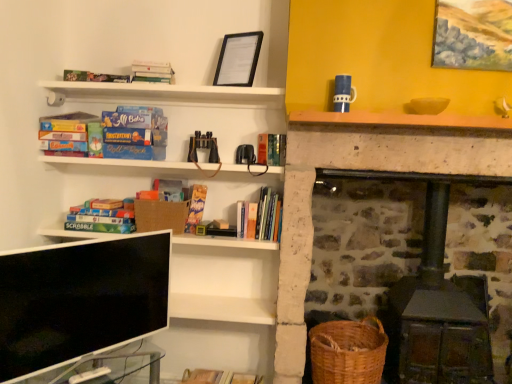
What is the approximate height of oil painting at upper right, acting as the second picture frame starting from the left?

It is 13.50 inches.

The height and width of the screenshot is (384, 512). What do you see at coordinates (79, 300) in the screenshot?
I see `matte white tv at lower left` at bounding box center [79, 300].

You are a GUI agent. You are given a task and a screenshot of the screen. Output one action in this format:
    pyautogui.click(x=<x>, y=<y>)
    Task: Click on the matte cardboard board game at left, marked as the fifth book in a right-to-left arrangement
    The image size is (512, 384).
    Given the screenshot: What is the action you would take?
    pyautogui.click(x=65, y=134)

What do you see at coordinates (65, 134) in the screenshot? The width and height of the screenshot is (512, 384). I see `matte cardboard board game at left, the 3th book positioned from the top` at bounding box center [65, 134].

Measure the distance between point (159, 356) and camera.

The distance of point (159, 356) from camera is 8.55 feet.

Locate an element on the screen. The height and width of the screenshot is (384, 512). burlap basket at lower left, the second basket viewed from the right is located at coordinates pos(160,215).

You are a GUI agent. You are given a task and a screenshot of the screen. Output one action in this format:
    pyautogui.click(x=<x>, y=<y>)
    Task: Click on the green matte scrabble board game at lower left, which is the first paperback book in left-to-right order
    The height and width of the screenshot is (384, 512).
    Given the screenshot: What is the action you would take?
    pyautogui.click(x=100, y=227)

At what (x,y) coordinates should I click in order to perform the action: click on oil painting at upper right, the second picture frame when ordered from back to front. Please return your answer as a coordinate pair (x, y). This screenshot has height=384, width=512. Looking at the image, I should click on (473, 34).

How different are the orientations of black matte picture frame at upper center, which is the second picture frame from front to back, and hardcover book at center, which is the 1th book in right-to-left order, in degrees?

There is a 26.2-degree angle between the facing directions of black matte picture frame at upper center, which is the second picture frame from front to back, and hardcover book at center, which is the 1th book in right-to-left order.

From a real-world perspective, does black matte picture frame at upper center, which is the 1th picture frame in left-to-right order, stand above hardcover book at center, the 5th book viewed from the left?

Correct, in the physical world, black matte picture frame at upper center, which is the 1th picture frame in left-to-right order, is higher than hardcover book at center, the 5th book viewed from the left.

Who is bigger, black matte picture frame at upper center, which ranks as the first picture frame in back-to-front order, or hardcover book at center, the 5th book viewed from the left?

black matte picture frame at upper center, which ranks as the first picture frame in back-to-front order.

From their relative heights in the image, would you say black matte picture frame at upper center, which is the second picture frame from front to back, is taller or shorter than hardcover book at center, the 5th book viewed from the left?

In the image, black matte picture frame at upper center, which is the second picture frame from front to back, appears to be taller than hardcover book at center, the 5th book viewed from the left.

How different are the orientations of oil painting at upper right, which is the 1th picture frame in right-to-left order, and black matte picture frame at upper center, which is the second picture frame from right to left, in degrees?

There is a 26.5-degree angle between the facing directions of oil painting at upper right, which is the 1th picture frame in right-to-left order, and black matte picture frame at upper center, which is the second picture frame from right to left.

From the image's perspective, which is above, oil painting at upper right, which is the 1th picture frame in right-to-left order, or black matte picture frame at upper center, which is the second picture frame from front to back?

From the image's view, oil painting at upper right, which is the 1th picture frame in right-to-left order, is above.

Is black matte picture frame at upper center, which is the 1th picture frame in left-to-right order, completely or partially inside oil painting at upper right, placed as the 1th picture frame when sorted from front to back?

No, black matte picture frame at upper center, which is the 1th picture frame in left-to-right order, is located outside of oil painting at upper right, placed as the 1th picture frame when sorted from front to back.

Considering the relative sizes of oil painting at upper right, acting as the second picture frame starting from the left, and black matte picture frame at upper center, which is the second picture frame from front to back, in the image provided, is oil painting at upper right, acting as the second picture frame starting from the left, shorter than black matte picture frame at upper center, which is the second picture frame from front to back,?

Incorrect, the height of oil painting at upper right, acting as the second picture frame starting from the left, does not fall short of that of black matte picture frame at upper center, which is the second picture frame from front to back.

Considering the sizes of black matte picture frame at upper center, which is the second picture frame from front to back, and hardcover book at upper center, the 5th book when ordered from bottom to top, in the image, is black matte picture frame at upper center, which is the second picture frame from front to back, taller or shorter than hardcover book at upper center, the 5th book when ordered from bottom to top,?

In the image, black matte picture frame at upper center, which is the second picture frame from front to back, appears to be taller than hardcover book at upper center, the 5th book when ordered from bottom to top.

This screenshot has width=512, height=384. There is a hardcover book at upper center, placed as the first book when sorted from top to bottom. Identify the location of the 1st picture frame above it (from the image's perspective). (238, 59).

Could you tell me if black matte picture frame at upper center, which is the second picture frame from right to left, is turned towards hardcover book at upper center, placed as the first book when sorted from top to bottom?

No, black matte picture frame at upper center, which is the second picture frame from right to left, is not turned towards hardcover book at upper center, placed as the first book when sorted from top to bottom.

The width and height of the screenshot is (512, 384). In order to click on the 5th book above the woven brown basket at lower right, the first basket from the right (from the image's perspective) in this screenshot , I will do `click(152, 72)`.

In terms of size, does woven brown basket at lower right, the second basket positioned from the left, appear bigger or smaller than hardcover book at upper center, acting as the 2th book starting from the right?

Clearly, woven brown basket at lower right, the second basket positioned from the left, is larger in size than hardcover book at upper center, acting as the 2th book starting from the right.

Are woven brown basket at lower right, the second basket positioned from the left, and hardcover book at upper center, placed as the first book when sorted from top to bottom, beside each other?

woven brown basket at lower right, the second basket positioned from the left, and hardcover book at upper center, placed as the first book when sorted from top to bottom, are clearly separated.

Considering the relative sizes of woven brown basket at lower right, the 2th basket positioned from the top, and hardcover book at upper center, placed as the first book when sorted from top to bottom, in the image provided, is woven brown basket at lower right, the 2th basket positioned from the top, taller than hardcover book at upper center, placed as the first book when sorted from top to bottom,?

Yes, woven brown basket at lower right, the 2th basket positioned from the top, is taller than hardcover book at upper center, placed as the first book when sorted from top to bottom.

Considering the relative sizes of matte cardboard board game at left, arranged as the first book when viewed from the left, and hardcover book at upper left, placed as the 3th book when sorted from left to right, in the image provided, is matte cardboard board game at left, arranged as the first book when viewed from the left, thinner than hardcover book at upper left, placed as the 3th book when sorted from left to right,?

Incorrect, the width of matte cardboard board game at left, arranged as the first book when viewed from the left, is not less than that of hardcover book at upper left, placed as the 3th book when sorted from left to right.

From a real-world perspective, relative to hardcover book at upper left, acting as the third book starting from the right, is matte cardboard board game at left, marked as the fifth book in a right-to-left arrangement, vertically above or below?

In terms of real-world spatial position, matte cardboard board game at left, marked as the fifth book in a right-to-left arrangement, is below hardcover book at upper left, acting as the third book starting from the right.

Which book is the 2nd one when counting from the right side of the matte cardboard board game at left, marked as the fifth book in a right-to-left arrangement? Please provide its 2D coordinates.

[(94, 77)]

Consider the image. Is matte cardboard board game at left, marked as the fifth book in a right-to-left arrangement, shorter than hardcover book at upper left, which is the 4th book in bottom-to-top order?

In fact, matte cardboard board game at left, marked as the fifth book in a right-to-left arrangement, may be taller than hardcover book at upper left, which is the 4th book in bottom-to-top order.

In the image, is hardcover book at center, which ranks as the 2th paperback book in bottom-to-top order, positioned in front of or behind woven brown basket at lower right, the second basket positioned from the left?

Clearly, hardcover book at center, which ranks as the 2th paperback book in bottom-to-top order, is behind woven brown basket at lower right, the second basket positioned from the left.

Does point (193, 195) appear closer or farther from the camera than point (354, 346)?

Point (193, 195) appears to be farther away from the viewer than point (354, 346).

Considering the sizes of hardcover book at center, arranged as the 3th paperback book when viewed from the left, and woven brown basket at lower right, the second basket positioned from the left, in the image, is hardcover book at center, arranged as the 3th paperback book when viewed from the left, wider or thinner than woven brown basket at lower right, the second basket positioned from the left,?

In the image, hardcover book at center, arranged as the 3th paperback book when viewed from the left, appears to be more narrow than woven brown basket at lower right, the second basket positioned from the left.

Between matte white tv at lower left and hardcover book at center, which is the 1th book in right-to-left order, which one has larger width?

With larger width is matte white tv at lower left.

Which is more to the left, matte white tv at lower left or hardcover book at center, the second book in the bottom-to-top sequence?

matte white tv at lower left.

Considering the relative positions of matte white tv at lower left and hardcover book at center, the second book in the bottom-to-top sequence, in the image provided, is matte white tv at lower left behind hardcover book at center, the second book in the bottom-to-top sequence,?

No, matte white tv at lower left is closer to the camera.

Which of these two, matte white tv at lower left or hardcover book at center, the second book in the bottom-to-top sequence, is bigger?

matte white tv at lower left is bigger.

The width and height of the screenshot is (512, 384). I want to click on book on the right of the black matte picture frame at upper center, which is the second picture frame from front to back, so click(x=271, y=149).

In order to click on picture frame that appears above the black matte picture frame at upper center, which ranks as the first picture frame in back-to-front order (from the image's perspective) in this screenshot , I will do `click(473, 34)`.

When comparing their distances from matte green paperback book at left, the first paperback book when ordered from top to bottom, does hardcover book at upper left, the second book viewed from the top, or hardcover book at center, acting as the first paperback book starting from the right, seem further?

hardcover book at center, acting as the first paperback book starting from the right.

When comparing their distances from matte green board game at left, the 5th book when ordered from top to bottom, does green matte scrabble board game at lower left, which is the first paperback book in left-to-right order, or matte white tv at lower left seem further?

The object further to matte green board game at left, the 5th book when ordered from top to bottom, is matte white tv at lower left.

Looking at the image, which one is located closer to transparent glass table at lower left, matte cardboard board game at left, marked as the fifth book in a right-to-left arrangement, or hardcover book at upper center, acting as the 2th book starting from the right?

matte cardboard board game at left, marked as the fifth book in a right-to-left arrangement, is closer to transparent glass table at lower left.

Estimate the real-world distances between objects in this image. Which object is closer to hardcover book at center, arranged as the 3th paperback book when viewed from the left, matte green paperback book at left, which ranks as the third paperback book in bottom-to-top order, or matte cardboard board game at left, the third book in the bottom-to-top sequence?

The object closer to hardcover book at center, arranged as the 3th paperback book when viewed from the left, is matte green paperback book at left, which ranks as the third paperback book in bottom-to-top order.

When comparing their distances from matte cardboard board game at left, arranged as the first book when viewed from the left, does hardcover book at center, the 5th book viewed from the left, or matte green board game at left, positioned as the 1th book in bottom-to-top order, seem closer?

matte green board game at left, positioned as the 1th book in bottom-to-top order, is closer to matte cardboard board game at left, arranged as the first book when viewed from the left.

When comparing their distances from oil painting at upper right, which is the 1th picture frame in right-to-left order, does matte green board game at left, the 5th book when ordered from top to bottom, or hardcover book at upper center, the 5th book when ordered from bottom to top, seem closer?

hardcover book at upper center, the 5th book when ordered from bottom to top, is closer to oil painting at upper right, which is the 1th picture frame in right-to-left order.

When comparing their distances from hardcover book at center, arranged as the 3th paperback book when viewed from the left, does hardcover book at center, the 5th book viewed from the left, or matte white tv at lower left seem closer?

The object closer to hardcover book at center, arranged as the 3th paperback book when viewed from the left, is hardcover book at center, the 5th book viewed from the left.

Estimate the real-world distances between objects in this image. Which object is closer to matte white tv at lower left, woven brown basket at lower right, which is counted as the first basket, starting from the bottom, or hardcover book at upper center, acting as the 2th book starting from the right?

Among the two, woven brown basket at lower right, which is counted as the first basket, starting from the bottom, is located nearer to matte white tv at lower left.

Where is `paperback book between matte white tv at lower left and woven brown basket at lower right, the first basket from the right, from left to right`? This screenshot has width=512, height=384. paperback book between matte white tv at lower left and woven brown basket at lower right, the first basket from the right, from left to right is located at coordinates coord(196,207).

Identify the location of picture frame between burlap basket at lower left, the second basket viewed from the right, and oil painting at upper right, acting as the second picture frame starting from the left, from left to right. (238, 59).

I want to click on picture frame located between hardcover book at upper center, acting as the 2th book starting from the right, and oil painting at upper right, placed as the 1th picture frame when sorted from front to back, in the left-right direction, so click(238, 59).

At what (x,y) coordinates should I click in order to perform the action: click on basket between matte green paperback book at left, the first paperback book when ordered from top to bottom, and green matte scrabble board game at lower left, which appears as the third paperback book when viewed from the top, in the vertical direction. Please return your answer as a coordinate pair (x, y). Looking at the image, I should click on (160, 215).